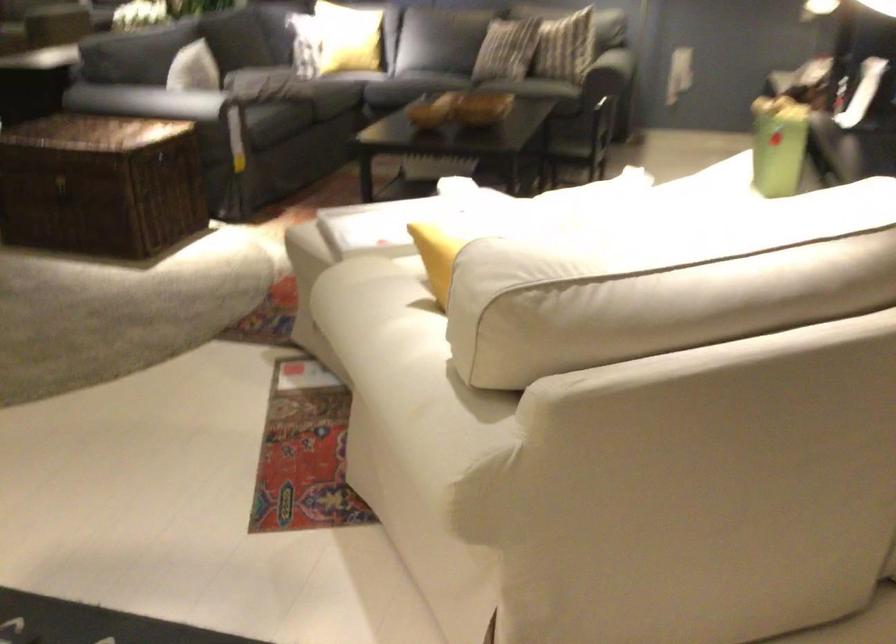
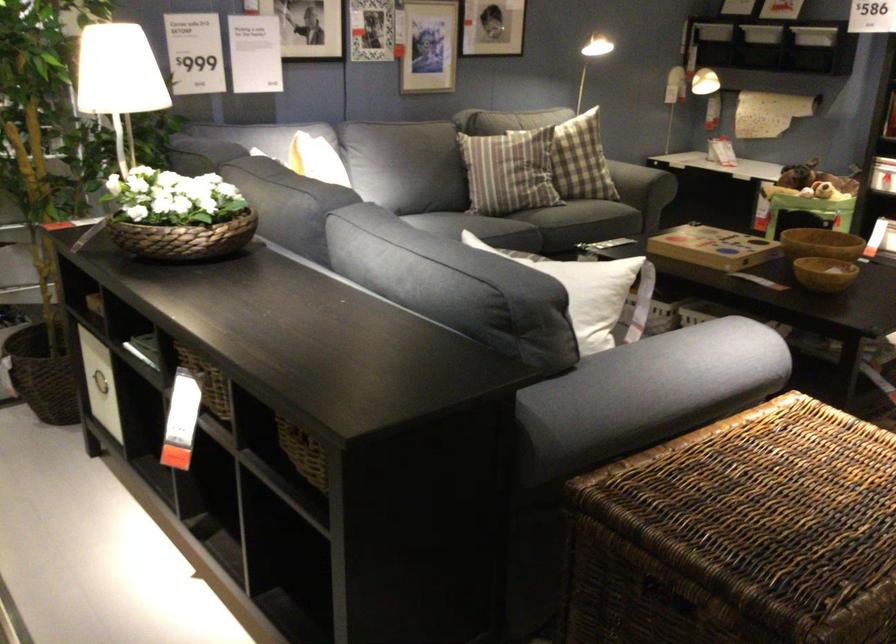
Find the pixel in the second image that matches (407,108) in the first image.

(823, 272)